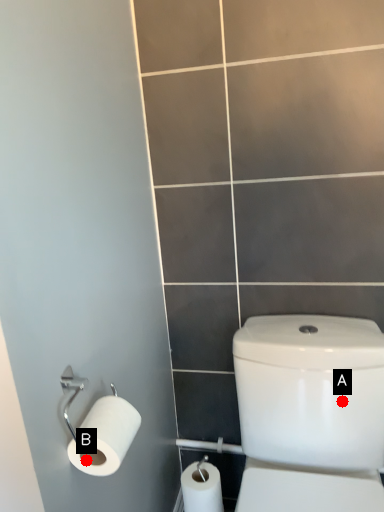
Question: Two points are circled on the image, labeled by A and B beside each circle. Which point is further to the camera?

Choices:
 (A) A is further
 (B) B is further

Answer: (A)